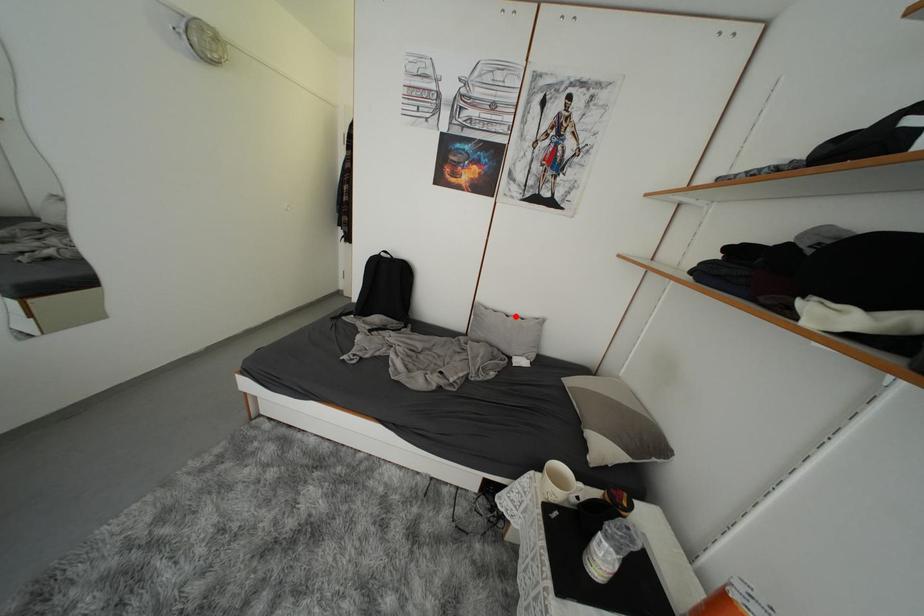
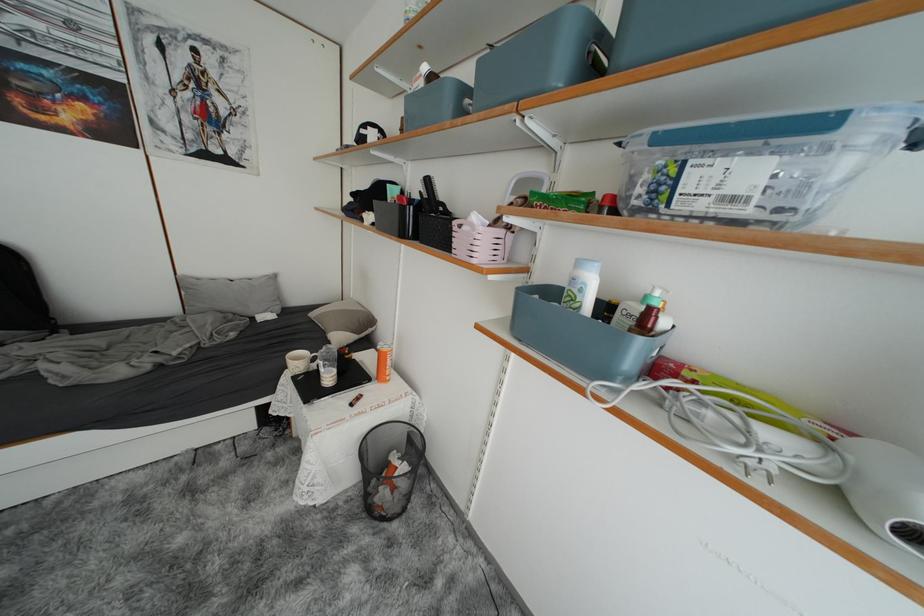
The point at the highlighted location is marked in the first image. Where is the corresponding point in the second image?

(238, 281)